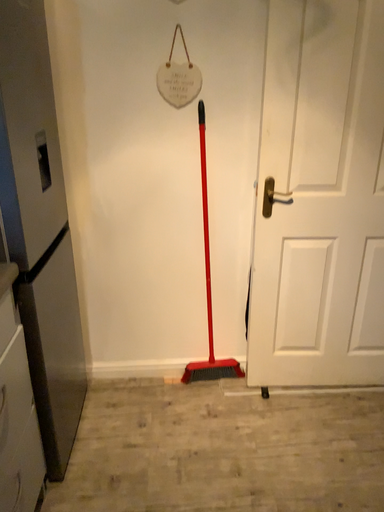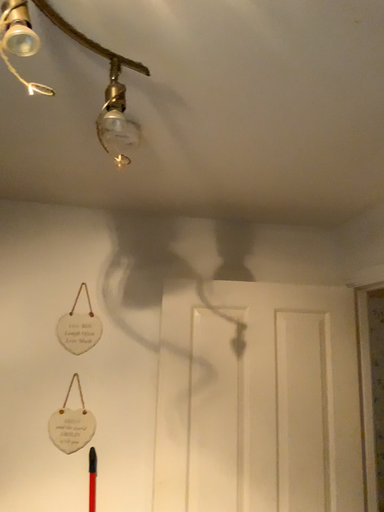
Question: How did the camera likely rotate when shooting the video?

Choices:
 (A) rotated left
 (B) rotated right

Answer: (B)